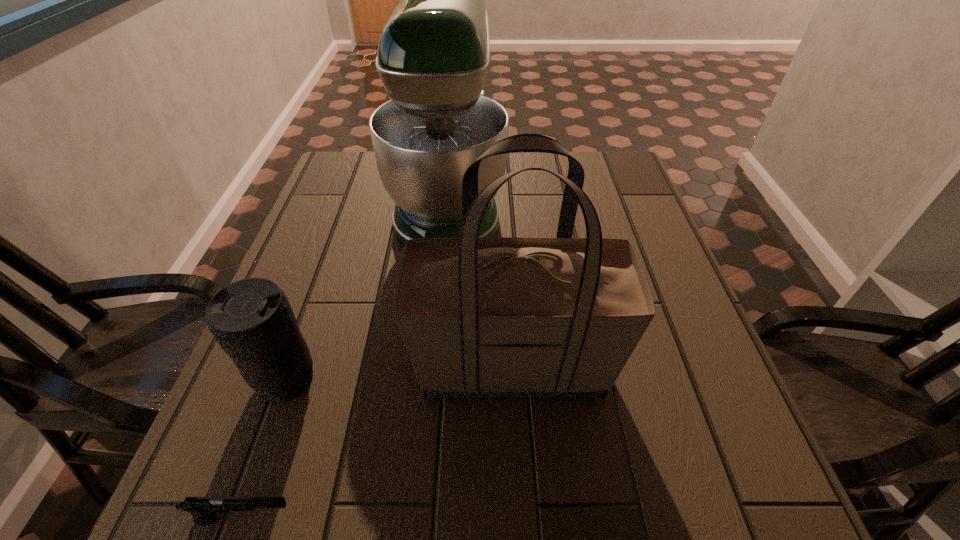
You are a GUI agent. You are given a task and a screenshot of the screen. Output one action in this format:
    pyautogui.click(x=<x>, y=<y>)
    Task: Click on the mixer
    
    Given the screenshot: What is the action you would take?
    pyautogui.click(x=432, y=58)

The width and height of the screenshot is (960, 540). I want to click on shopping bag, so click(x=509, y=316).

The image size is (960, 540). In order to click on the third tallest object in this screenshot , I will do `click(251, 319)`.

At what (x,y) coordinates should I click in order to perform the action: click on the nearest object. Please return your answer as a coordinate pair (x, y). Looking at the image, I should click on (204, 509).

At what (x,y) coordinates should I click in order to perform the action: click on the shortest object. Please return your answer as a coordinate pair (x, y). The image size is (960, 540). Looking at the image, I should click on (204, 509).

Identify the location of vacant area situated on the controls of the mixer. This screenshot has height=540, width=960. (605, 200).

Locate an element on the screen. free space located with handles facing forward on the shopping bag is located at coordinates (254, 366).

Where is `blank space located with handles facing forward on the shopping bag`? blank space located with handles facing forward on the shopping bag is located at coordinates (285, 366).

Where is `blank space located with handles facing forward on the shopping bag`? The width and height of the screenshot is (960, 540). blank space located with handles facing forward on the shopping bag is located at coordinates (254, 366).

Identify the location of vacant area situated 0.110m on the side of the third tallest object where the control switches are located. (254, 470).